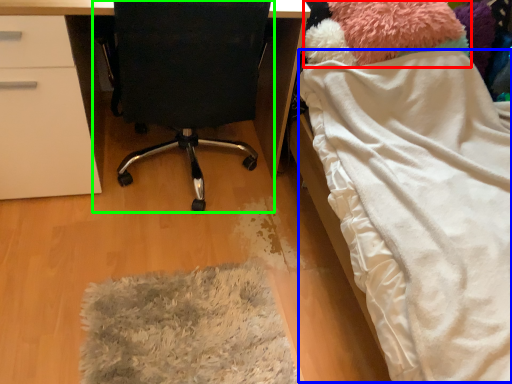
Question: Which object is positioned closest to teddy (highlighted by a red box)? Select from blanket (highlighted by a blue box) and chair (highlighted by a green box).

Choices:
 (A) blanket
 (B) chair

Answer: (A)